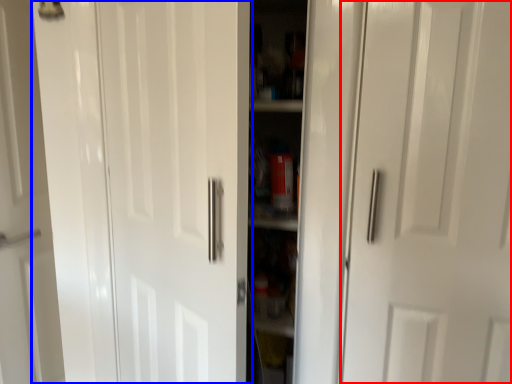
Question: Among these objects, which one is farthest to the camera, door (highlighted by a red box) or door (highlighted by a blue box)?

Choices:
 (A) door
 (B) door

Answer: (A)